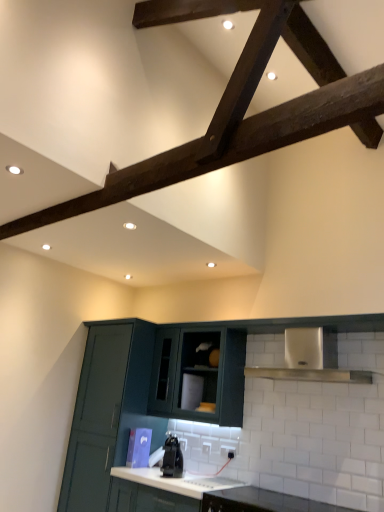
Question: From the image's perspective, is white glossy countertop at lower center, the second countertop in the left-to-right sequence, positioned above or below matte dark green cabinet at center, the 2th cabinetry viewed from the left?

Choices:
 (A) below
 (B) above

Answer: (A)

Question: Do you think white glossy countertop at lower center, arranged as the 1th countertop when viewed from the right, is within matte dark green cabinet at center, the 2th cabinetry viewed from the left, or outside of it?

Choices:
 (A) inside
 (B) outside

Answer: (B)

Question: Which is farther from the matte dark green cabinet at center, which is the second cabinetry in right-to-left order?

Choices:
 (A) matte dark green cabinet at center, the 3th cabinetry from the left
 (B) white glossy countertop at center, arranged as the second countertop when viewed from the right
 (C) white glossy countertop at lower center, arranged as the 1th countertop when viewed from the right
 (D) black glossy kettle at center
 (E) matte dark green cabinet at lower left, which ranks as the first cabinetry in left-to-right order

Answer: (C)

Question: Considering the real-world distances, which object is closest to the matte dark green cabinet at lower left, which is the 3th cabinetry from right to left?

Choices:
 (A) matte dark green cabinet at center, the 2th cabinetry viewed from the left
 (B) white glossy countertop at center, the first countertop in the left-to-right sequence
 (C) black glossy kettle at center
 (D) matte dark green cabinet at center, the 1th cabinetry in the right-to-left sequence
 (E) white glossy countertop at lower center, the second countertop in the left-to-right sequence

Answer: (D)